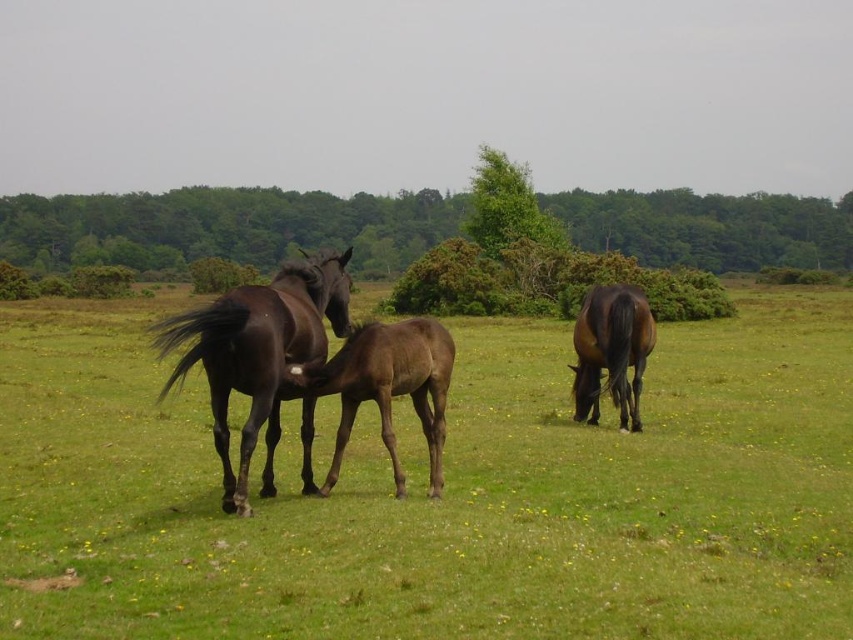
Question: Which point is closer to the camera?

Choices:
 (A) shiny brown horse at right
 (B) brown glossy horse at center

Answer: (B)

Question: Among these objects, which one is farthest from the camera?

Choices:
 (A) dark brown glossy horse at center
 (B) brown glossy horse at center
 (C) shiny dark brown horse at center
 (D) shiny brown horse at right

Answer: (D)

Question: Is brown glossy horse at center closer to camera compared to shiny dark brown horse at center?

Choices:
 (A) no
 (B) yes

Answer: (B)

Question: Which object appears farthest from the camera in this image?

Choices:
 (A) dark brown glossy horse at center
 (B) brown glossy horse at center

Answer: (A)

Question: Considering the relative positions of shiny dark brown horse at center and dark brown glossy horse at center in the image provided, where is shiny dark brown horse at center located with respect to dark brown glossy horse at center?

Choices:
 (A) above
 (B) below

Answer: (B)

Question: Where is brown glossy horse at center located in relation to dark brown glossy horse at center in the image?

Choices:
 (A) above
 (B) below

Answer: (B)